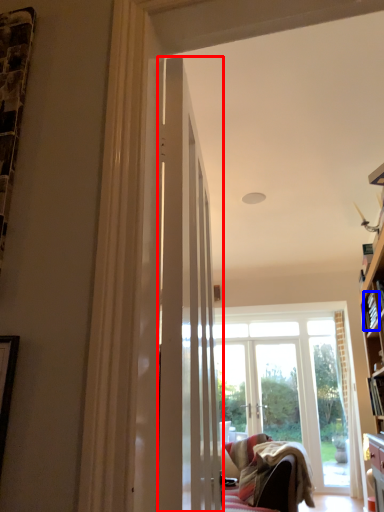
Question: Which of the following is the closest to the observer, door (highlighted by a red box) or book (highlighted by a blue box)?

Choices:
 (A) door
 (B) book

Answer: (A)